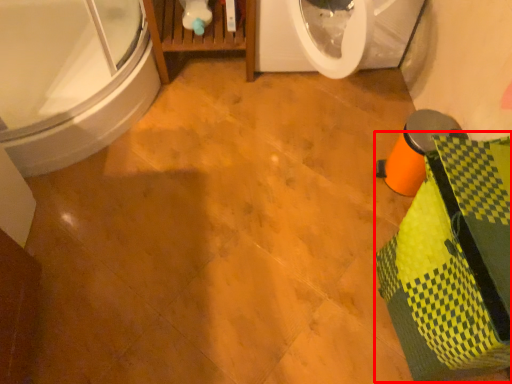
Question: From the image's perspective, where is material (annotated by the red box) located in relation to bathtub in the image?

Choices:
 (A) below
 (B) above

Answer: (A)